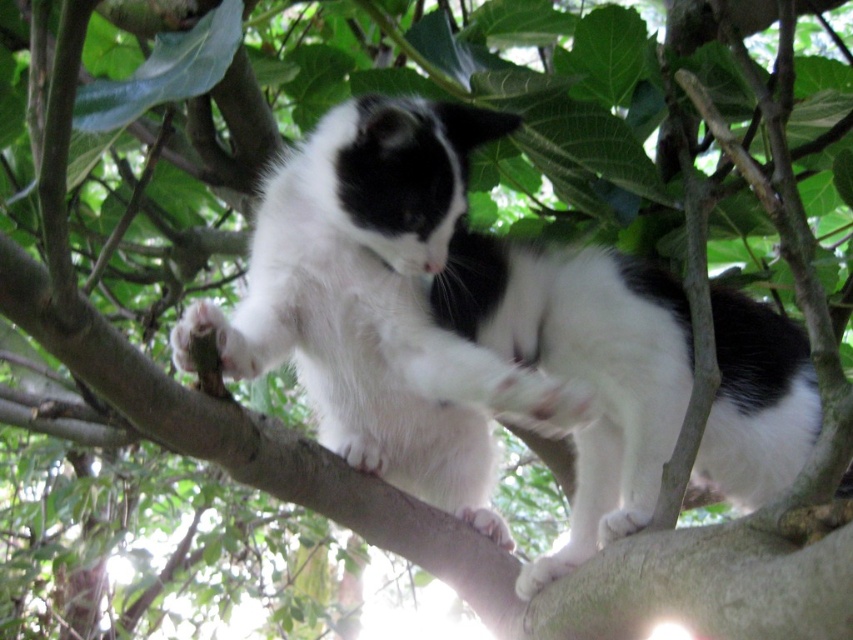
Question: Does white fluffy cat at center appear under black and white fur at center?

Choices:
 (A) no
 (B) yes

Answer: (A)

Question: Among these points, which one is nearest to the camera?

Choices:
 (A) (207, 305)
 (B) (599, 504)
 (C) (338, 237)

Answer: (A)

Question: Is white fluffy cat at center below white soft fur paw at center?

Choices:
 (A) yes
 (B) no

Answer: (B)

Question: Is black and white fur at center thinner than white soft fur paw at center?

Choices:
 (A) yes
 (B) no

Answer: (B)

Question: Which is farther from the black and white fur at center?

Choices:
 (A) white soft fur paw at center
 (B) white fluffy cat at center

Answer: (A)

Question: Which is nearer to the black and white fur at center?

Choices:
 (A) white fluffy cat at center
 (B) white soft fur paw at center

Answer: (A)